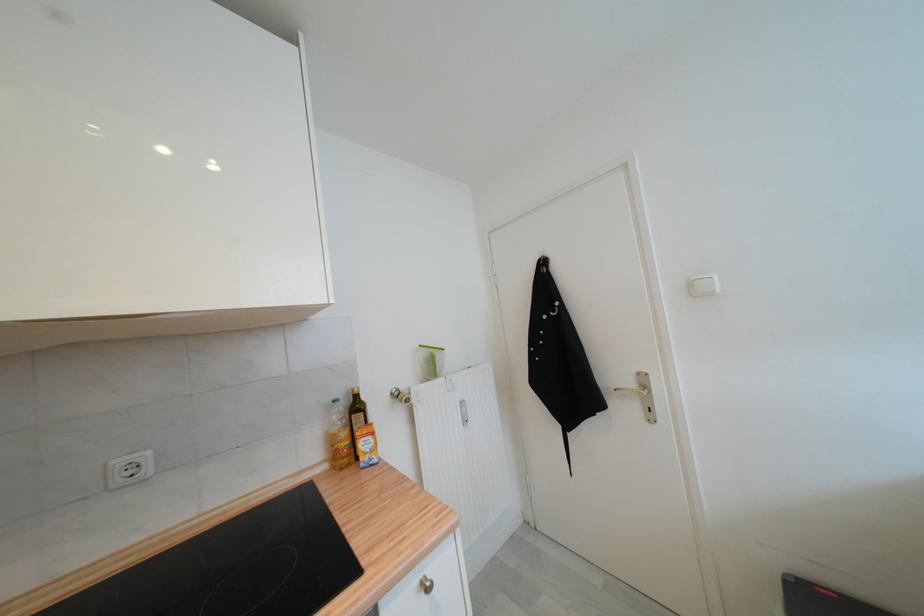
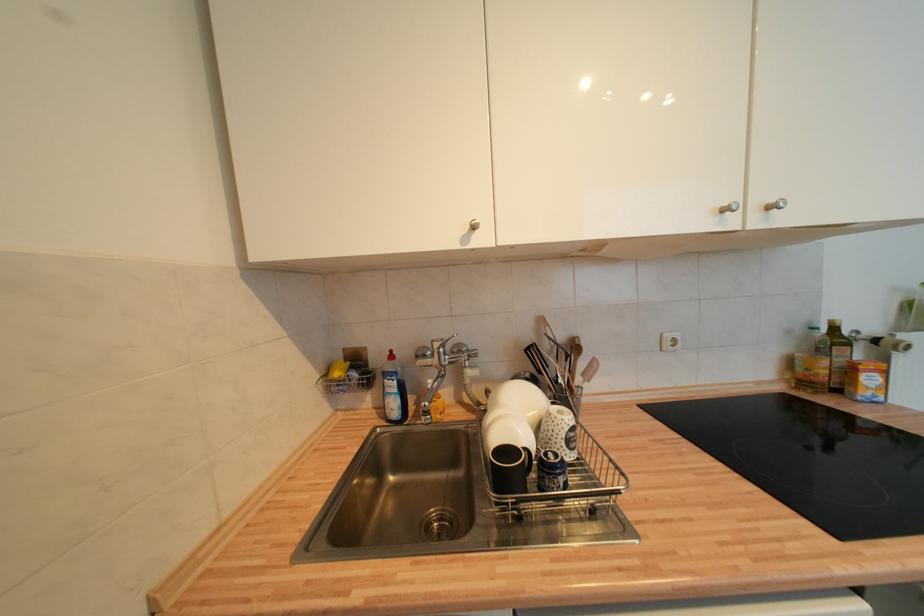
Find the pixel in the second image that matches (361,398) in the first image.

(840, 331)